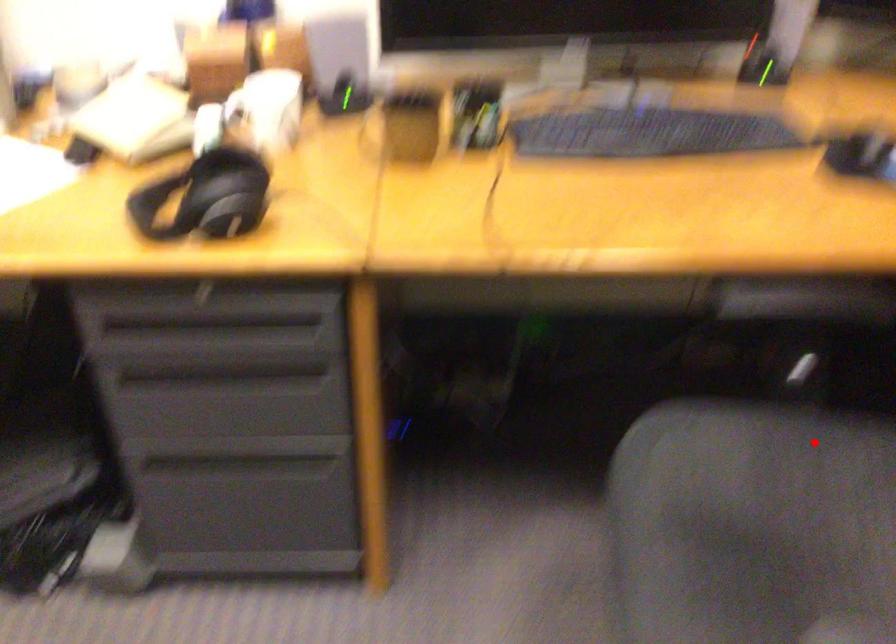
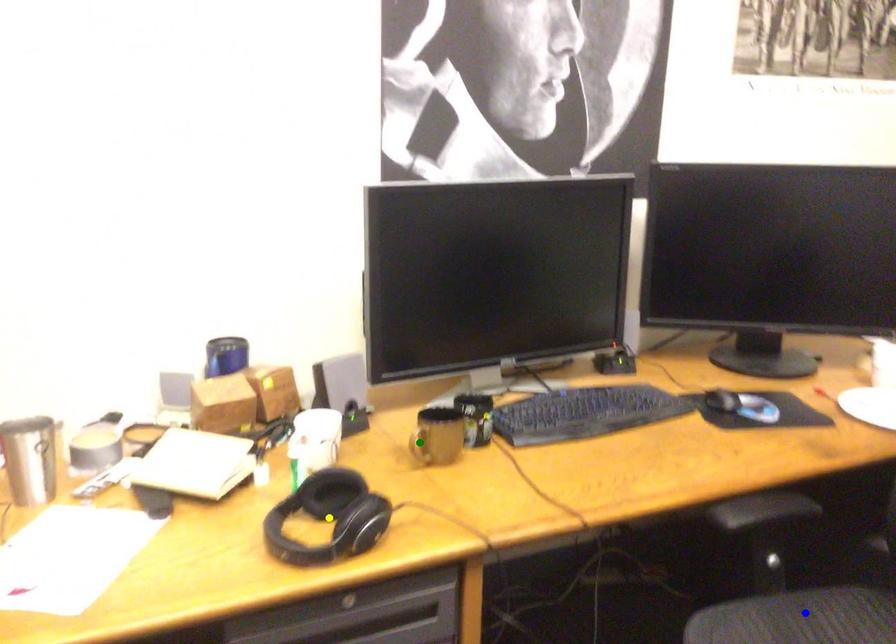
Question: I am providing you with two images of the same scene from different viewpoints. A red point is marked on the first image. You are given multiple points on the second image. Which point in image 2 represents the same 3d spot as the red point in image 1?

Choices:
 (A) blue point
 (B) green point
 (C) yellow point

Answer: (A)